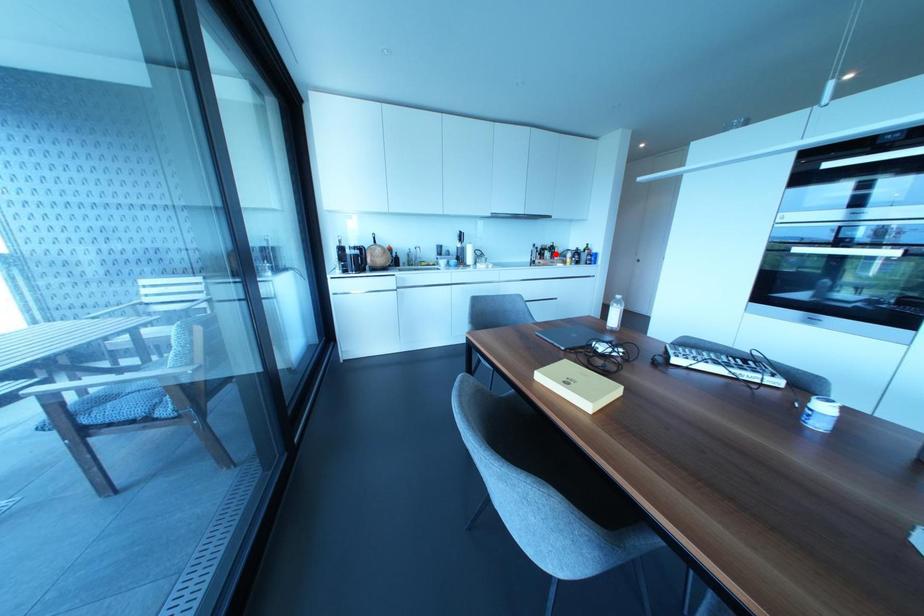
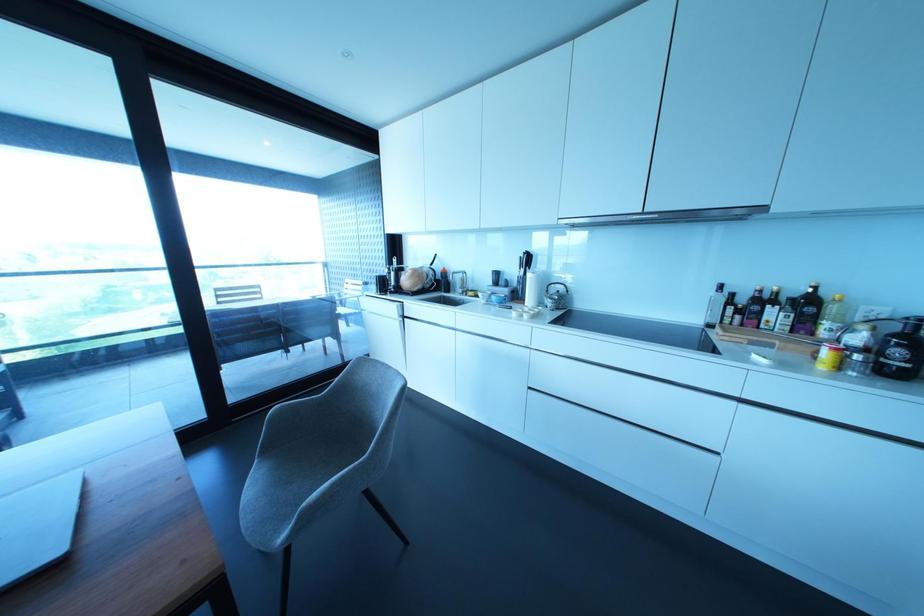
Question: I am providing you with two images of the same scene from different viewpoints. A red point is marked on the first image. Can you still see the location of the red point in image 2?

Choices:
 (A) Yes
 (B) No

Answer: (A)